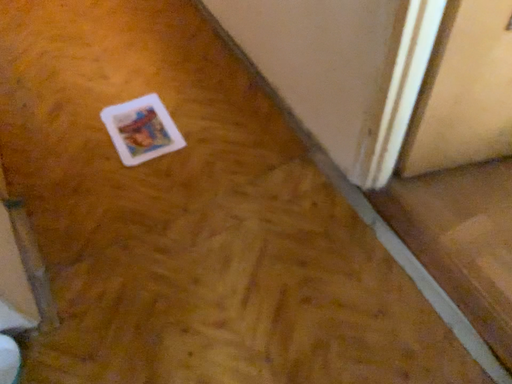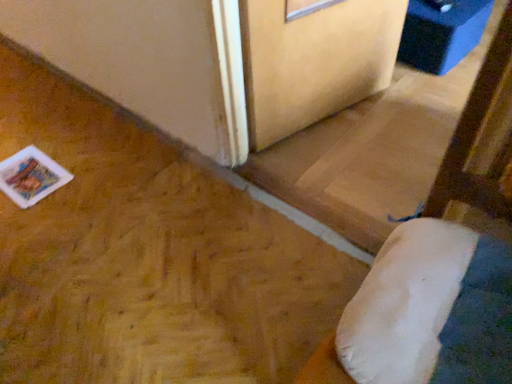
Question: How did the camera likely rotate when shooting the video?

Choices:
 (A) rotated right
 (B) rotated left

Answer: (A)